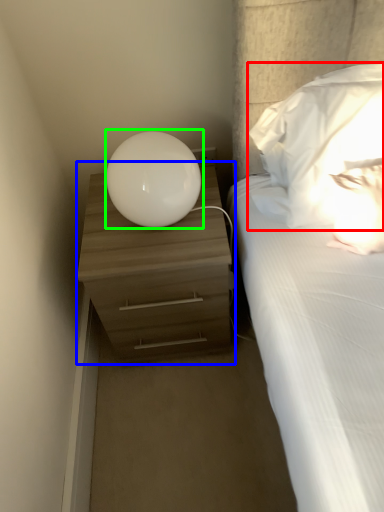
Question: Based on their relative distances, which object is farther from pillow (highlighted by a red box)? Choose from nightstand (highlighted by a blue box) and table lamp (highlighted by a green box).

Choices:
 (A) nightstand
 (B) table lamp

Answer: (A)